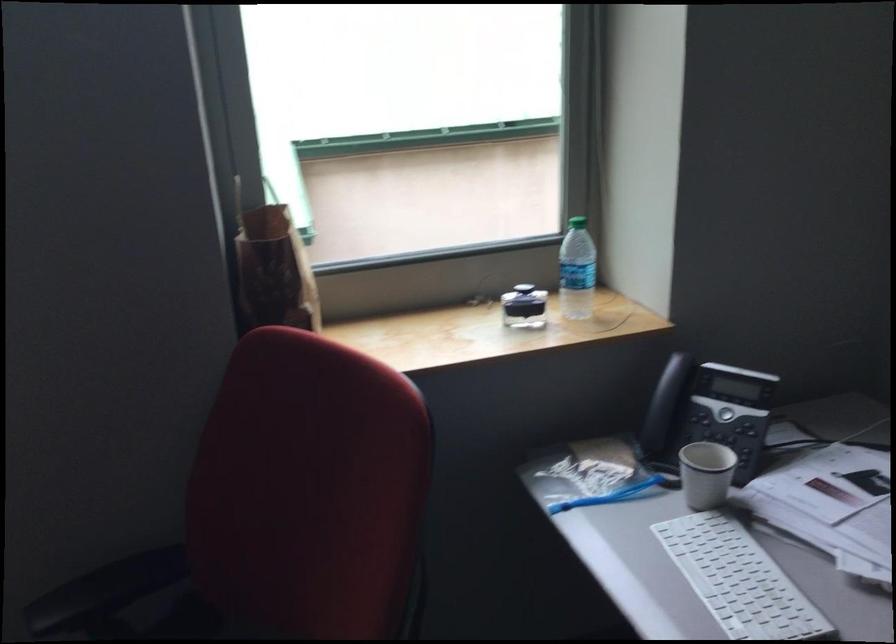
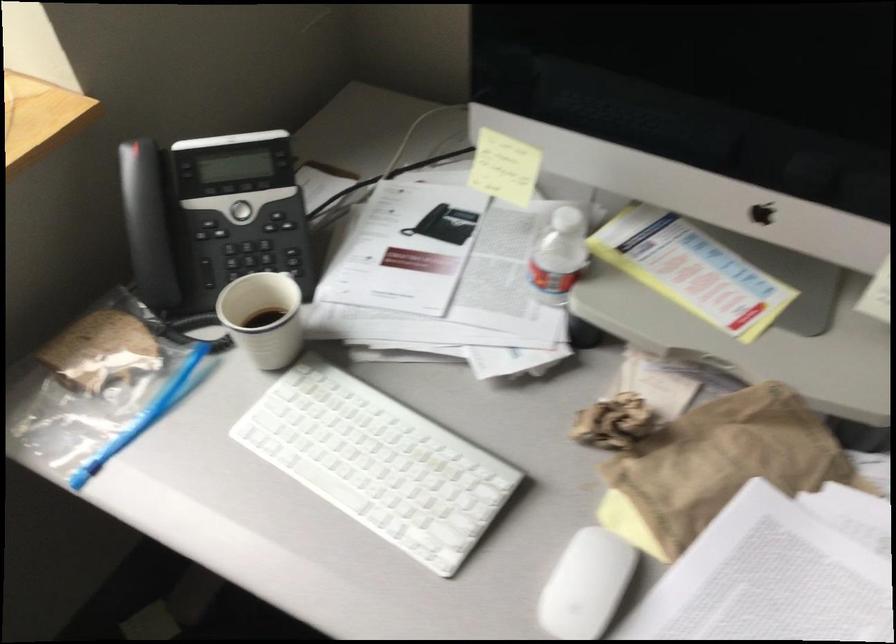
Locate, in the second image, the point that corresponds to (x=636, y=489) in the first image.

(173, 384)